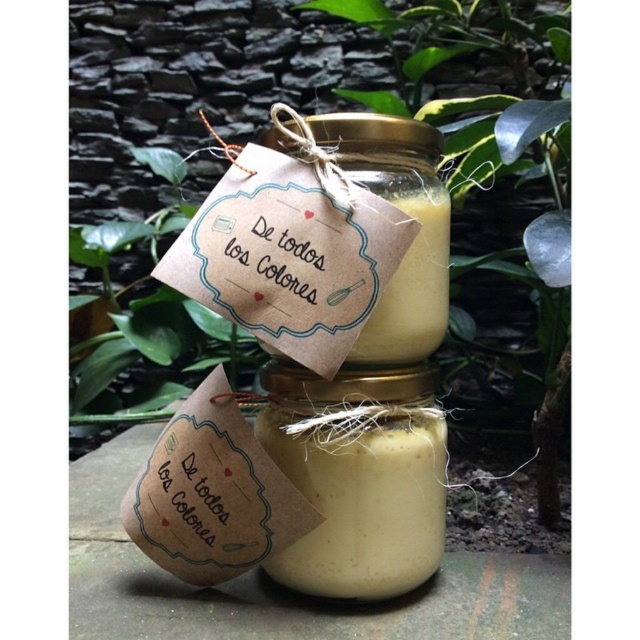
Question: Considering the real-world distances, which object is farthest from the translucent glass jar at center?

Choices:
 (A) green leafy plant at center
 (B) matte kraft paper jar at center
 (C) yellow matte jar at center

Answer: (A)

Question: Does translucent glass jar at center have a greater width compared to yellow matte jar at center?

Choices:
 (A) no
 (B) yes

Answer: (B)

Question: Observing the image, what is the correct spatial positioning of green leafy plant at center in reference to translucent glass jar at center?

Choices:
 (A) above
 (B) below

Answer: (A)

Question: Among these objects, which one is farthest from the camera?

Choices:
 (A) translucent glass jar at center
 (B) matte kraft paper jar at center

Answer: (A)

Question: Can you confirm if green leafy plant at center is positioned above yellow matte jar at center?

Choices:
 (A) no
 (B) yes

Answer: (B)

Question: Estimate the real-world distances between objects in this image. Which object is farther from the matte kraft paper jar at center?

Choices:
 (A) translucent glass jar at center
 (B) yellow matte jar at center

Answer: (A)